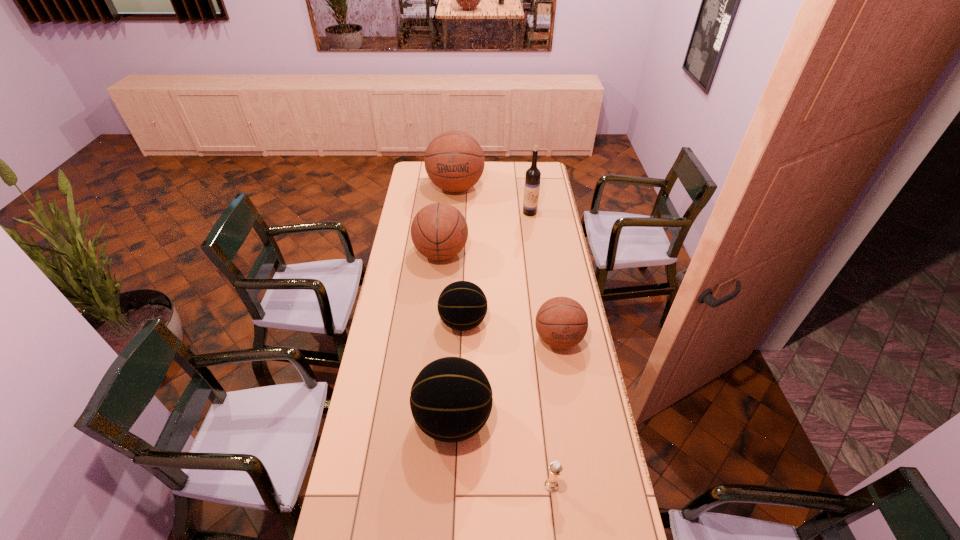
Image resolution: width=960 pixels, height=540 pixels. Find the location of `black wine bottle`. black wine bottle is located at coordinates pyautogui.click(x=532, y=178).

Where is `wine bottle`? Image resolution: width=960 pixels, height=540 pixels. wine bottle is located at coordinates (532, 178).

Find the location of a particular element. The width and height of the screenshot is (960, 540). the biggest brown basketball is located at coordinates (454, 160).

Image resolution: width=960 pixels, height=540 pixels. In order to click on the farthest object in this screenshot , I will do `click(454, 160)`.

Image resolution: width=960 pixels, height=540 pixels. What are the coordinates of `the third farthest object` in the screenshot? It's located at (439, 231).

In order to click on the second nearest brown basketball in this screenshot , I will do `click(439, 231)`.

Where is `the sixth farthest object`? The image size is (960, 540). the sixth farthest object is located at coordinates click(x=451, y=399).

This screenshot has width=960, height=540. In order to click on the nearer black basketball in this screenshot , I will do `click(451, 399)`.

Identify the location of the nearest brown basketball. (561, 322).

In order to click on the rightmost brown basketball in this screenshot , I will do [561, 322].